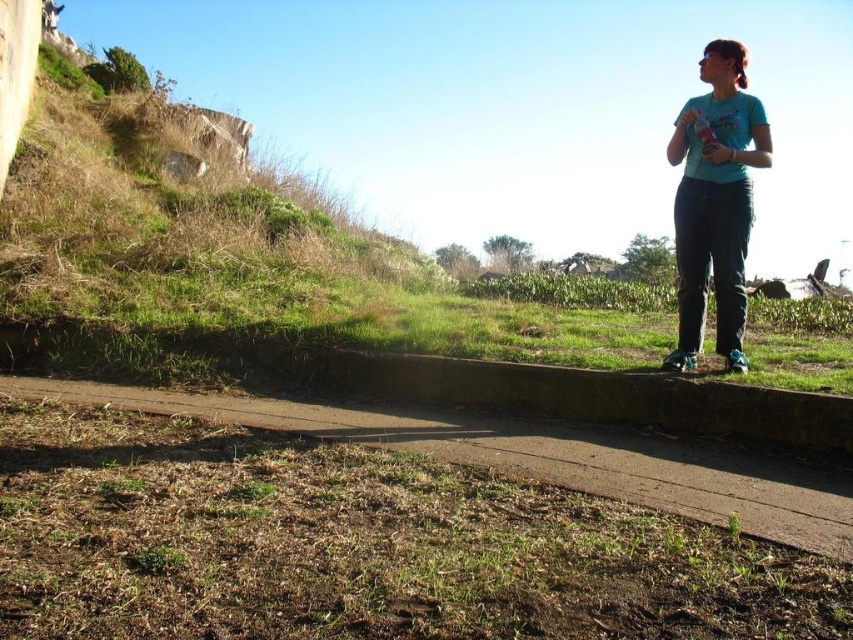
Question: Which point is closer to the camera?

Choices:
 (A) blue cotton shirt at upper right
 (B) brown concrete path at center

Answer: (B)

Question: Does brown concrete path at center have a larger size compared to blue cotton shirt at upper right?

Choices:
 (A) yes
 (B) no

Answer: (A)

Question: Can you confirm if brown concrete path at center is positioned below blue cotton shirt at upper right?

Choices:
 (A) no
 (B) yes

Answer: (B)

Question: Does brown concrete path at center have a larger size compared to blue cotton shirt at upper right?

Choices:
 (A) no
 (B) yes

Answer: (B)